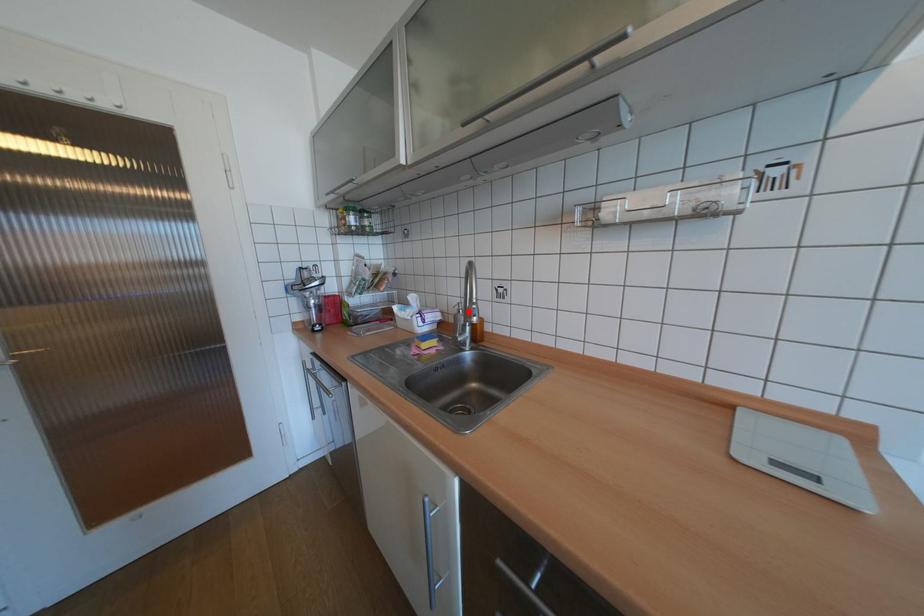
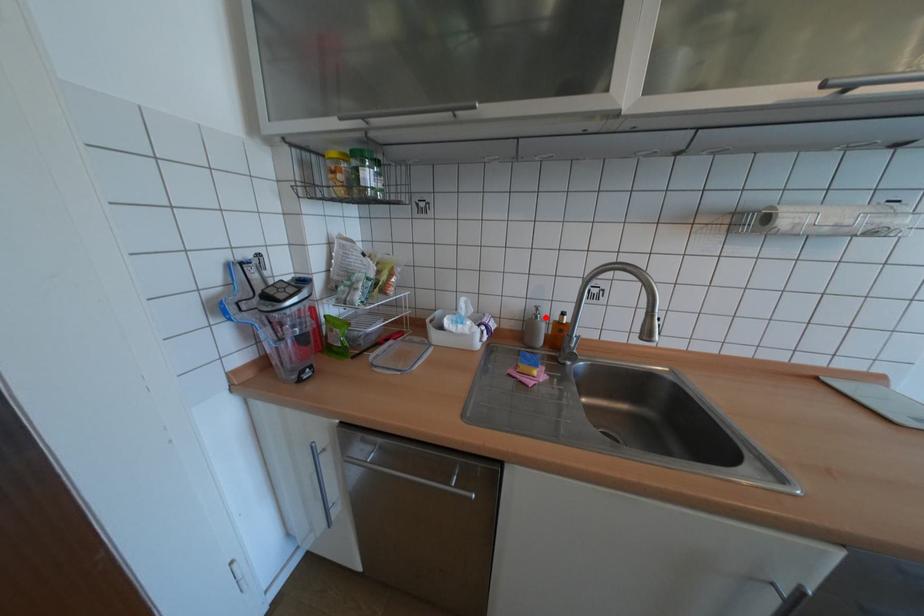
I am providing you with two images of the same scene from different viewpoints. A red point is marked on the first image and another point is marked on the second image. Do the highlighted points in image1 and image2 indicate the same real-world spot?

Yes